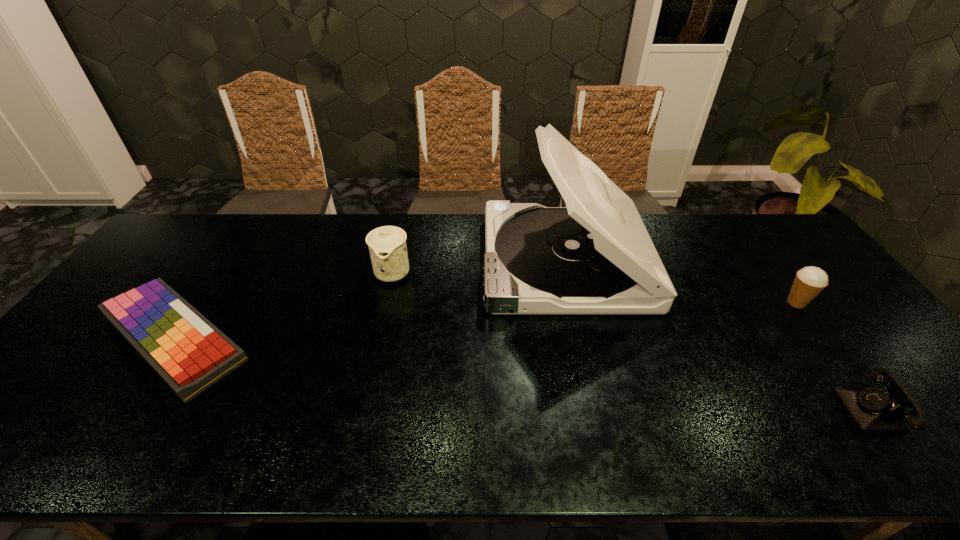
The image size is (960, 540). I want to click on free space that is in between the leftmost object and the second object from left to right, so click(283, 305).

At what (x,y) coordinates should I click in order to perform the action: click on free space between the CD player and the chinaware. Please return your answer as a coordinate pair (x, y). Looking at the image, I should click on (479, 267).

I want to click on free space between the third object from left to right and the third tallest object, so click(x=681, y=282).

You are a GUI agent. You are given a task and a screenshot of the screen. Output one action in this format:
    pyautogui.click(x=<x>, y=<y>)
    Task: Click on the empty space that is in between the tallest object and the fourth object from right to left
    This screenshot has height=540, width=960.
    Given the screenshot: What is the action you would take?
    pyautogui.click(x=479, y=267)

Locate an element on the screen. This screenshot has height=540, width=960. free space between the fourth tallest object and the second tallest object is located at coordinates (632, 337).

At what (x,y) coordinates should I click in order to perform the action: click on unoccupied position between the telephone and the third object from right to left. Please return your answer as a coordinate pair (x, y). This screenshot has width=960, height=540. Looking at the image, I should click on (717, 331).

Find the location of a particular element. free point between the third object from right to left and the third shortest object is located at coordinates (681, 282).

Identify the location of free space that is in between the shortest object and the icecream. This screenshot has width=960, height=540. (485, 320).

Identify which object is the fourth nearest to the telephone. Please provide its 2D coordinates. Your answer should be formatted as a tuple, i.e. [(x, y)], where the tuple contains the x and y coordinates of a point satisfying the conditions above.

[(190, 353)]

Where is `object that ranks as the third closest to the computer keyboard`? The height and width of the screenshot is (540, 960). object that ranks as the third closest to the computer keyboard is located at coordinates click(x=872, y=410).